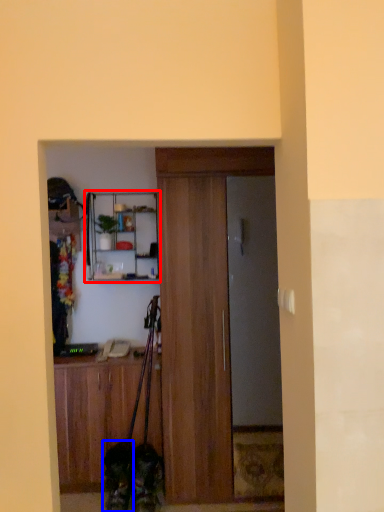
Question: Which point is closer to the camera, shelf (highlighted by a red box) or dog (highlighted by a blue box)?

Choices:
 (A) shelf
 (B) dog

Answer: (B)